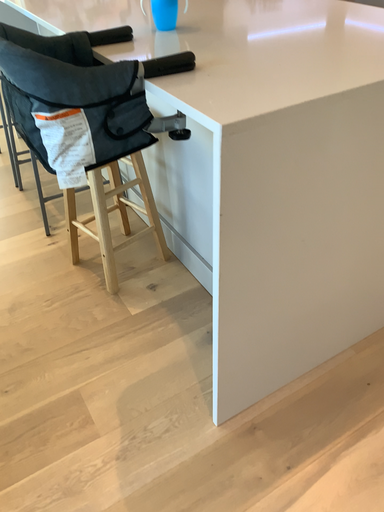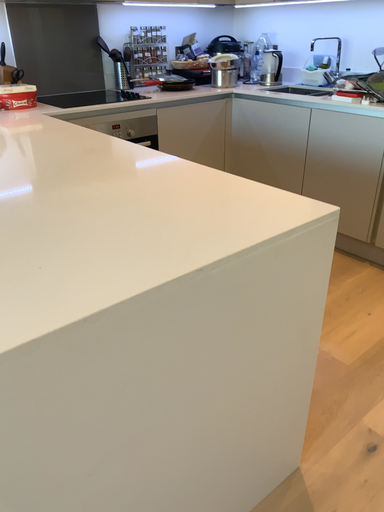
Question: Which way did the camera rotate in the video?

Choices:
 (A) rotated left
 (B) rotated right

Answer: (B)